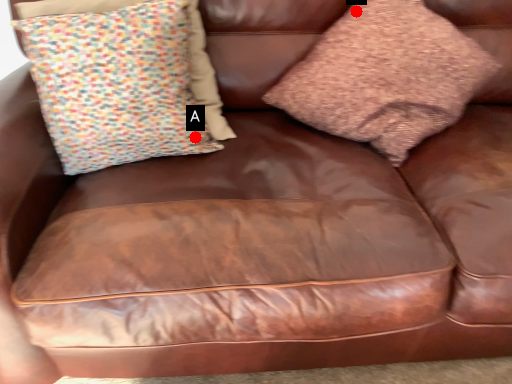
Question: Two points are circled on the image, labeled by A and B beside each circle. Among these points, which one is nearest to the camera?

Choices:
 (A) A is closer
 (B) B is closer

Answer: (A)